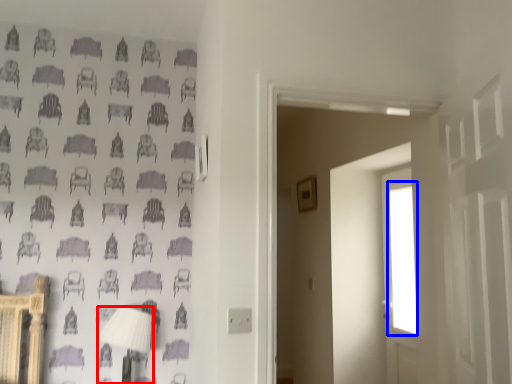
Question: Which of the following is the farthest to the observer, table lamp (highlighted by a red box) or window (highlighted by a blue box)?

Choices:
 (A) table lamp
 (B) window

Answer: (B)